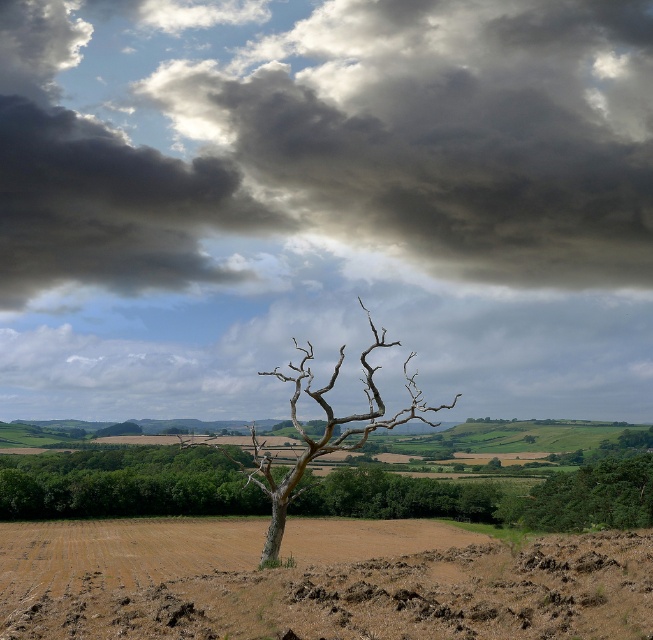
Is dark gray cloud at upper center smaller than brown soil at center?

Actually, dark gray cloud at upper center might be larger than brown soil at center.

Is dark gray cloud at upper center taller than brown soil at center?

Yes, dark gray cloud at upper center is taller than brown soil at center.

Based on the photo, who is more distant from viewer, (x=611, y=129) or (x=488, y=608)?

The point (x=611, y=129) is more distant.

At what (x,y) coordinates should I click in order to perform the action: click on dark gray cloud at upper center. Please return your answer as a coordinate pair (x, y). Looking at the image, I should click on (330, 141).

Is brown bark tree at center bigger than green leafy tree at right?

Yes, brown bark tree at center is bigger than green leafy tree at right.

Which of these two, brown bark tree at center or green leafy tree at right, stands shorter?

green leafy tree at right is shorter.

Is point (266, 460) in front of point (586, 524)?

Yes.

Locate an element on the screen. Image resolution: width=653 pixels, height=640 pixels. brown bark tree at center is located at coordinates (325, 432).

Is point (594, 241) positioned before point (547, 506)?

That is False.

Can you confirm if dark gray cloud at upper center is taller than green leafy tree at right?

Yes.

Identify the location of dark gray cloud at upper center. (330, 141).

Where is `dark gray cloud at upper center`? The width and height of the screenshot is (653, 640). dark gray cloud at upper center is located at coordinates (330, 141).